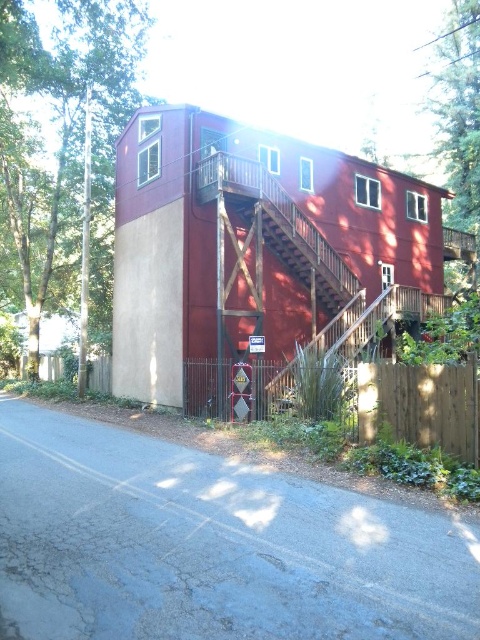
Question: Does green leafy tree at left appear on the left side of wooden fence at lower left?

Choices:
 (A) yes
 (B) no

Answer: (A)

Question: Among these objects, which one is nearest to the camera?

Choices:
 (A) wooden fence at lower left
 (B) green leafy tree at left

Answer: (A)

Question: Is green leafy tree at left closer to the viewer compared to wooden fence at lower left?

Choices:
 (A) yes
 (B) no

Answer: (B)

Question: Can you confirm if green leafy tree at left is smaller than wooden fence at lower left?

Choices:
 (A) no
 (B) yes

Answer: (A)